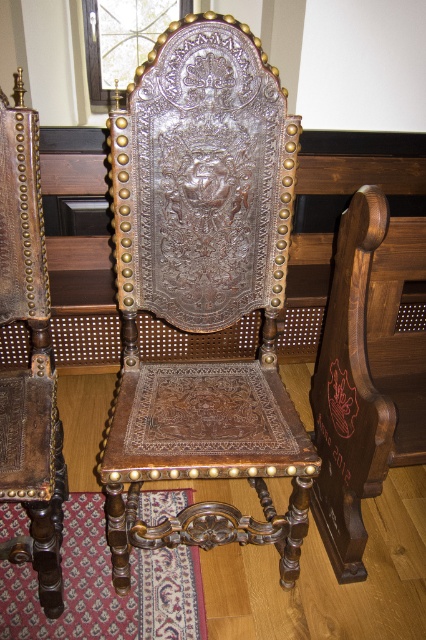
Between point (158, 456) and point (39, 282), which one is positioned behind?

Positioned behind is point (39, 282).

Between point (178, 28) and point (28, 186), which one is positioned in front?

Positioned in front is point (178, 28).

Where is `polished wood armchair at center`? polished wood armchair at center is located at coordinates (204, 289).